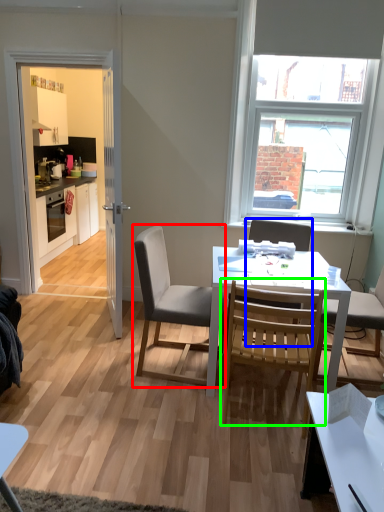
Question: Which is nearer to the chair (highlighted by a red box)? chair (highlighted by a blue box) or chair (highlighted by a green box).

Choices:
 (A) chair
 (B) chair

Answer: (B)